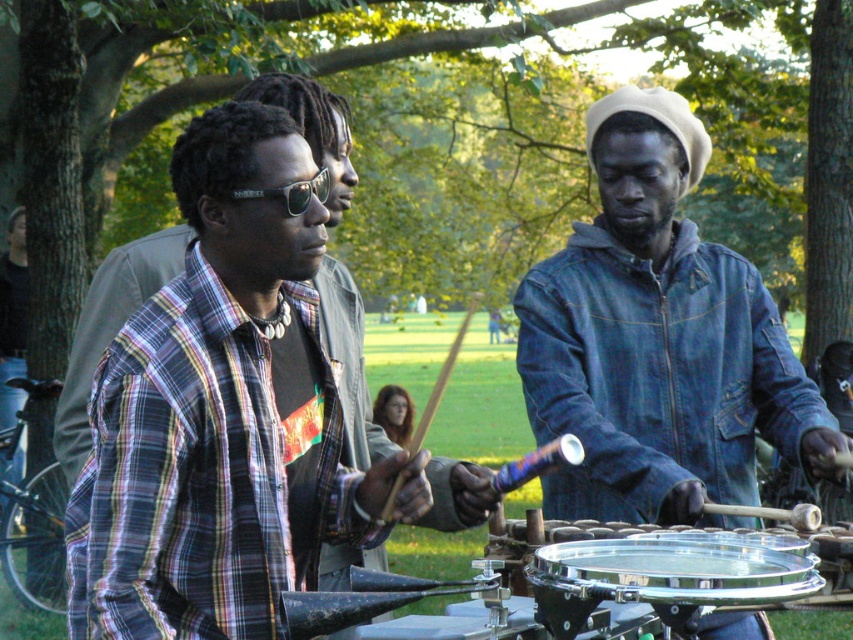
What is the 2D coordinate of the denim jacket at center in the image?

The denim jacket at center is located at the 2D coordinate point of (659, 340).

You are a photographer trying to capture the entire scene of the three musicians. You notice a point at coordinates (659, 340) on your camera screen. What object is located at that point?

The point at coordinates (659, 340) marks the denim jacket at center.

You are a photographer standing in front of the scene. You want to take a photo of the shiny metallic drum at center without the denim jacket at center blocking it. Is this possible?

The denim jacket at center is further to the viewer than the shiny metallic drum at center, so the denim jacket is closer to you. Therefore, it will block your view of the shiny metallic drum at center. You cannot take a photo of the shiny metallic drum at center without the denim jacket at center blocking it.